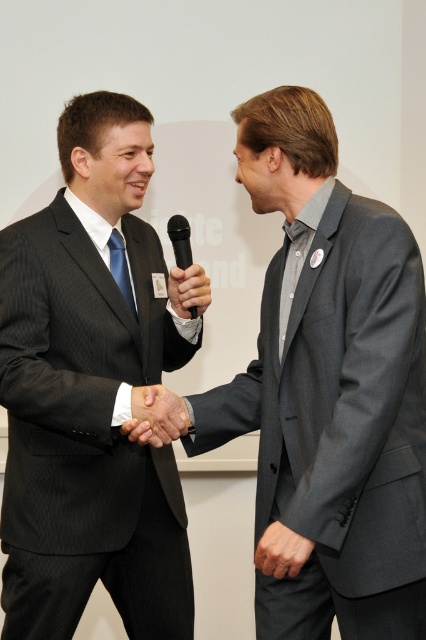
Consider the image. Is gray pinstripe suit at center smaller than smooth gray suit at center?

No.

Which is above, gray pinstripe suit at center or smooth gray suit at center?

Positioned higher is gray pinstripe suit at center.

Between point (371, 632) and point (287, 531), which one is positioned in front?

Point (287, 531)

The image size is (426, 640). Identify the location of gray pinstripe suit at center. (330, 387).

Between point (138, 396) and point (198, 280), which one is positioned in front?

Positioned in front is point (138, 396).

Is matte black hand at center thinner than black matte microphone at center?

In fact, matte black hand at center might be wider than black matte microphone at center.

Is point (161, 436) positioned after point (172, 305)?

No, (161, 436) is closer to viewer.

Locate an element on the screen. Image resolution: width=426 pixels, height=640 pixels. matte black hand at center is located at coordinates (155, 416).

Which is above, matte black suit at center or black plastic microphone at center?

Positioned higher is black plastic microphone at center.

In the scene shown: Which is more to the right, matte black suit at center or black plastic microphone at center?

black plastic microphone at center

Is point (88, 337) behind point (190, 257)?

That is False.

You are a GUI agent. You are given a task and a screenshot of the screen. Output one action in this format:
    pyautogui.click(x=<x>, y=<y>)
    Task: Click on the matte black suit at center
    This screenshot has height=640, width=426.
    Given the screenshot: What is the action you would take?
    pyautogui.click(x=91, y=392)